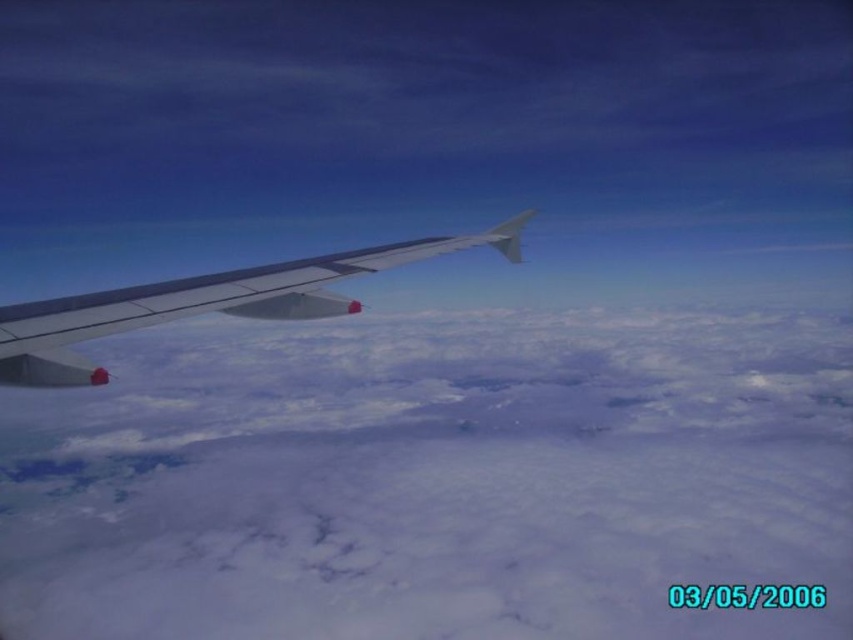
How far apart are white fluffy cloud at left and metallic gray wing at left?

471.85 meters

Who is positioned more to the left, white fluffy cloud at left or metallic gray wing at left?

metallic gray wing at left

The image size is (853, 640). What do you see at coordinates (433, 477) in the screenshot?
I see `white fluffy cloud at left` at bounding box center [433, 477].

Locate an element on the screen. The width and height of the screenshot is (853, 640). white fluffy cloud at left is located at coordinates (433, 477).